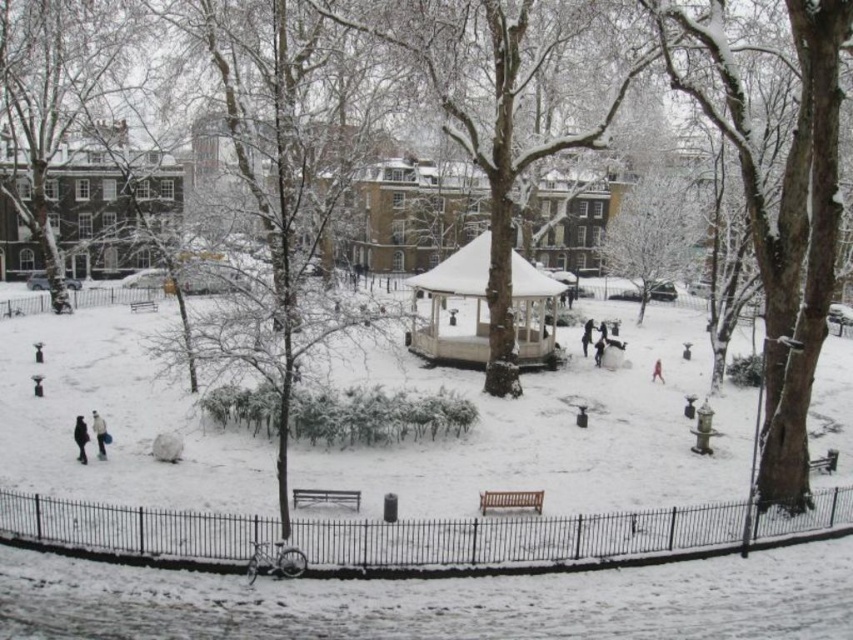
Is point (135, 579) less distant than point (654, 369)?

Yes.

Where is `white fluffy snow at center`? The width and height of the screenshot is (853, 640). white fluffy snow at center is located at coordinates (440, 602).

Can you confirm if white wooden gazebo at center is bigger than red fabric coat at center?

Yes, white wooden gazebo at center is bigger than red fabric coat at center.

The width and height of the screenshot is (853, 640). In order to click on white wooden gazebo at center in this screenshot , I will do `click(454, 307)`.

Which is behind, point (80, 314) or point (447, 268)?

The point (80, 314) is more distant.

Between white fluffy snow at center and white wooden gazebo at center, which one appears on the right side from the viewer's perspective?

white wooden gazebo at center

This screenshot has height=640, width=853. Find the location of `white fluffy snow at center`. white fluffy snow at center is located at coordinates [440, 602].